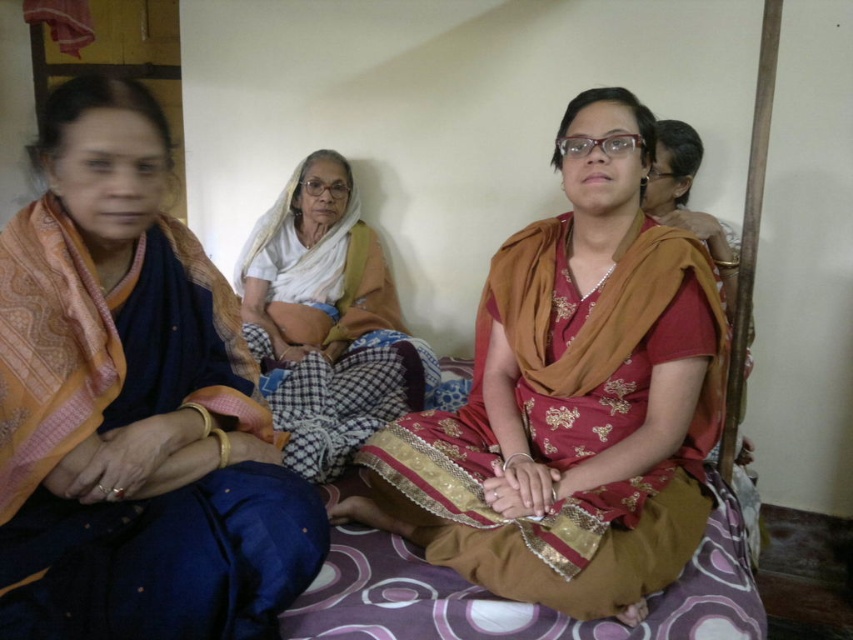
What do you see at coordinates (572, 397) in the screenshot? The width and height of the screenshot is (853, 640). I see `matte brown sari at center` at bounding box center [572, 397].

Who is shorter, matte brown sari at center or white cotton saree at center?

matte brown sari at center is shorter.

Does point (563, 458) lie behind point (363, 378)?

That is False.

Identify the location of matte brown sari at center. (572, 397).

Who is higher up, blue silk saree at left or matte brown sari at center?

matte brown sari at center is above.

Is point (48, 211) positioned before point (660, 348)?

Yes, point (48, 211) is closer to viewer.

Which is behind, point (144, 209) or point (577, 193)?

The point (577, 193) is more distant.

Where is `blue silk saree at left`? blue silk saree at left is located at coordinates (132, 404).

Between blue silk saree at left and white cotton saree at center, which one has less height?

blue silk saree at left is shorter.

From the picture: Can you confirm if blue silk saree at left is taller than white cotton saree at center?

In fact, blue silk saree at left may be shorter than white cotton saree at center.

You are a GUI agent. You are given a task and a screenshot of the screen. Output one action in this format:
    pyautogui.click(x=<x>, y=<y>)
    Task: Click on the blue silk saree at left
    Image resolution: width=853 pixels, height=640 pixels.
    Given the screenshot: What is the action you would take?
    pyautogui.click(x=132, y=404)